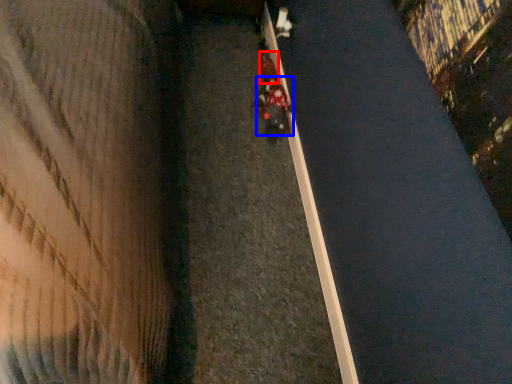
Question: Which object is further to the camera taking this photo, pedestrian (highlighted by a red box) or person (highlighted by a blue box)?

Choices:
 (A) pedestrian
 (B) person

Answer: (A)